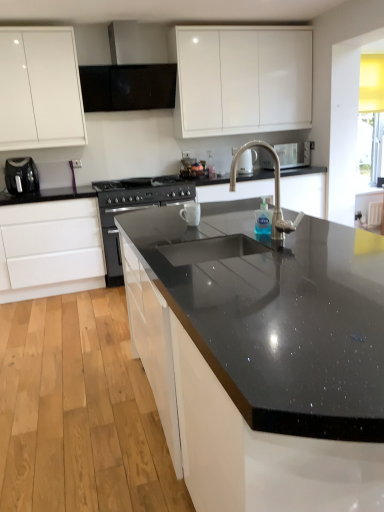
Question: Would you say black granite sink at center contains black matte exhaust hood at upper center?

Choices:
 (A) yes
 (B) no

Answer: (B)

Question: Can you confirm if black granite sink at center is positioned to the right of black matte exhaust hood at upper center?

Choices:
 (A) no
 (B) yes

Answer: (B)

Question: Is black granite sink at center positioned with its back to black matte exhaust hood at upper center?

Choices:
 (A) no
 (B) yes

Answer: (A)

Question: Is black granite sink at center outside black matte exhaust hood at upper center?

Choices:
 (A) yes
 (B) no

Answer: (A)

Question: Considering the relative sizes of black granite sink at center and black matte exhaust hood at upper center in the image provided, is black granite sink at center taller than black matte exhaust hood at upper center?

Choices:
 (A) yes
 (B) no

Answer: (A)

Question: Is black granite sink at center taller or shorter than satin nickel faucet at upper center, placed as the 2th appliance when sorted from front to back?

Choices:
 (A) short
 (B) tall

Answer: (B)

Question: Would you say black granite sink at center is inside or outside satin nickel faucet at upper center, which ranks as the 1th appliance in top-to-bottom order?

Choices:
 (A) inside
 (B) outside

Answer: (B)

Question: Is point (271, 154) closer or farther from the camera than point (304, 157)?

Choices:
 (A) closer
 (B) farther

Answer: (B)

Question: Is black granite sink at center to the left or to the right of satin nickel faucet at upper center, placed as the 2th appliance when sorted from front to back, in the image?

Choices:
 (A) right
 (B) left

Answer: (B)

Question: From the image's perspective, is black matte exhaust hood at upper center located above or below black granite sink at center?

Choices:
 (A) above
 (B) below

Answer: (A)

Question: Is black matte exhaust hood at upper center inside the boundaries of black granite sink at center, or outside?

Choices:
 (A) outside
 (B) inside

Answer: (A)

Question: From a real-world perspective, is black matte exhaust hood at upper center positioned above or below black granite sink at center?

Choices:
 (A) below
 (B) above

Answer: (B)

Question: Considering their positions, is black matte exhaust hood at upper center located in front of or behind black granite sink at center?

Choices:
 (A) behind
 (B) front

Answer: (B)

Question: Considering their positions, is black granite sink at center located in front of or behind black matte exhaust hood at upper center?

Choices:
 (A) behind
 (B) front

Answer: (A)

Question: In terms of height, does black granite sink at center look taller or shorter compared to black matte exhaust hood at upper center?

Choices:
 (A) tall
 (B) short

Answer: (A)